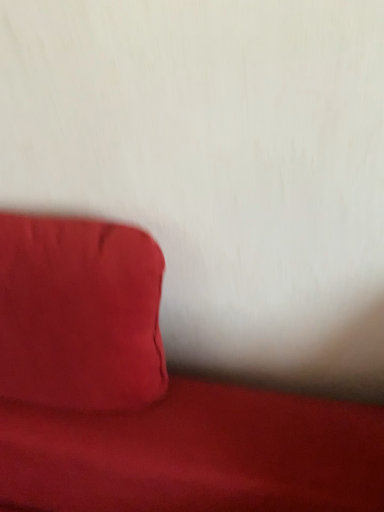
Image resolution: width=384 pixels, height=512 pixels. In order to click on satin red pillow at left in this screenshot , I will do `click(79, 314)`.

Measure the distance between satin red pillow at left and camera.

satin red pillow at left and camera are 20.09 inches apart.

What do you see at coordinates (79, 314) in the screenshot? This screenshot has width=384, height=512. I see `satin red pillow at left` at bounding box center [79, 314].

Identify the location of satin red pillow at left. (79, 314).